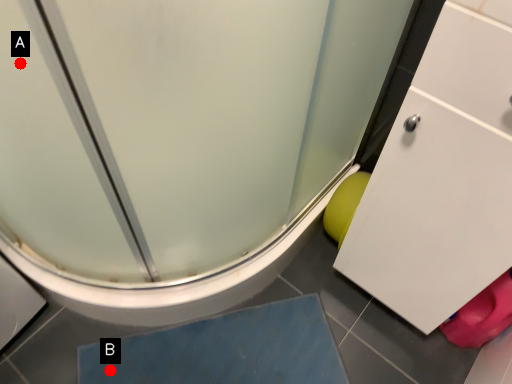
Question: Two points are circled on the image, labeled by A and B beside each circle. Which point is farther to the camera?

Choices:
 (A) A is further
 (B) B is further

Answer: (B)